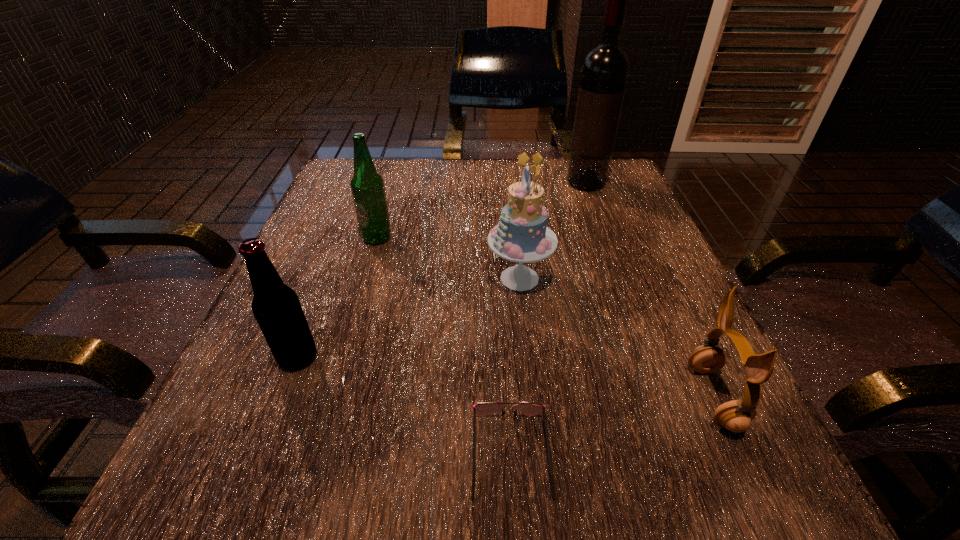
This screenshot has height=540, width=960. In order to click on the farthest object in this screenshot , I will do `click(604, 73)`.

Find the location of a particular element. The width and height of the screenshot is (960, 540). wine bottle is located at coordinates [604, 73].

At what (x,y) coordinates should I click in order to perform the action: click on the third farthest object. Please return your answer as a coordinate pair (x, y). This screenshot has height=540, width=960. Looking at the image, I should click on (521, 235).

Where is `the second farthest object`? the second farthest object is located at coordinates (367, 186).

Identify the location of the fifth object from right to left. Image resolution: width=960 pixels, height=540 pixels. (367, 186).

Locate an element on the screen. Image resolution: width=960 pixels, height=540 pixels. the leftmost object is located at coordinates tap(276, 307).

The image size is (960, 540). I want to click on the left beer bottle, so [276, 307].

Find the location of `the fifth tallest object`. the fifth tallest object is located at coordinates (736, 415).

The width and height of the screenshot is (960, 540). What are the coordinates of `sunglasses` in the screenshot? It's located at (482, 408).

Where is `vacant space located on the left of the farthest object`? vacant space located on the left of the farthest object is located at coordinates (521, 183).